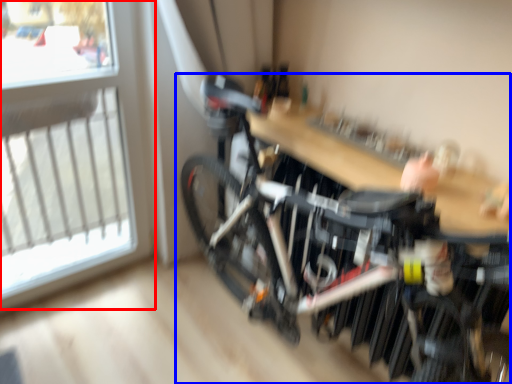
Question: Which object is further to the camera taking this photo, window (highlighted by a red box) or bicycle (highlighted by a blue box)?

Choices:
 (A) window
 (B) bicycle

Answer: (A)